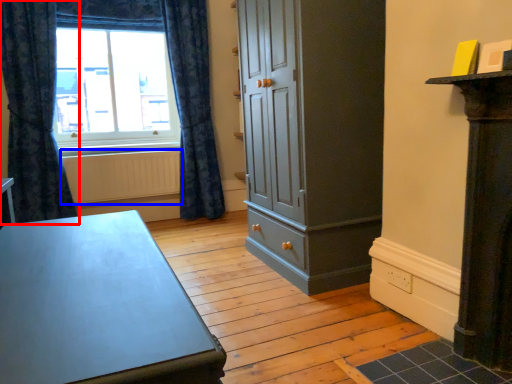
Question: Which object is closer to the camera taking this photo, curtain (highlighted by a red box) or radiator (highlighted by a blue box)?

Choices:
 (A) curtain
 (B) radiator

Answer: (A)